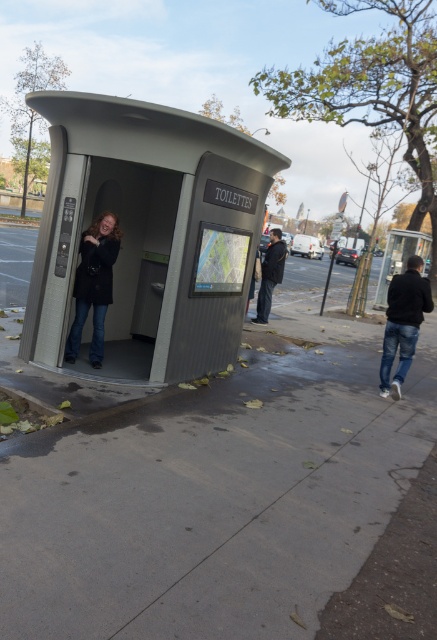
Which of these two, metallic gray bus stop at center or matte black jacket at center, stands taller?

With more height is metallic gray bus stop at center.

Between metallic gray bus stop at center and matte black jacket at center, which one has less height?

Standing shorter between the two is matte black jacket at center.

Which is behind, point (145, 349) or point (87, 269)?

The point (145, 349) is more distant.

Find the location of a particular element. metallic gray bus stop at center is located at coordinates (149, 230).

Does gray concrete sidewalk at lower center appear under metallic gray bus stop at center?

Correct, gray concrete sidewalk at lower center is located below metallic gray bus stop at center.

Based on the photo, can you confirm if gray concrete sidewalk at lower center is positioned to the right of metallic gray bus stop at center?

No, gray concrete sidewalk at lower center is not to the right of metallic gray bus stop at center.

You are a GUI agent. You are given a task and a screenshot of the screen. Output one action in this format:
    pyautogui.click(x=<x>, y=<y>)
    Task: Click on the gray concrete sidewalk at lower center
    
    Given the screenshot: What is the action you would take?
    pyautogui.click(x=218, y=490)

Which is above, metallic gray bus stop at center or dark blue jeans at center?

Positioned higher is dark blue jeans at center.

Does point (120, 291) come closer to viewer compared to point (271, 280)?

Yes.

Does point (107, 326) come farther from viewer compared to point (280, 243)?

No, it is in front of (280, 243).

Locate an element on the screen. This screenshot has height=640, width=437. metallic gray bus stop at center is located at coordinates (149, 230).